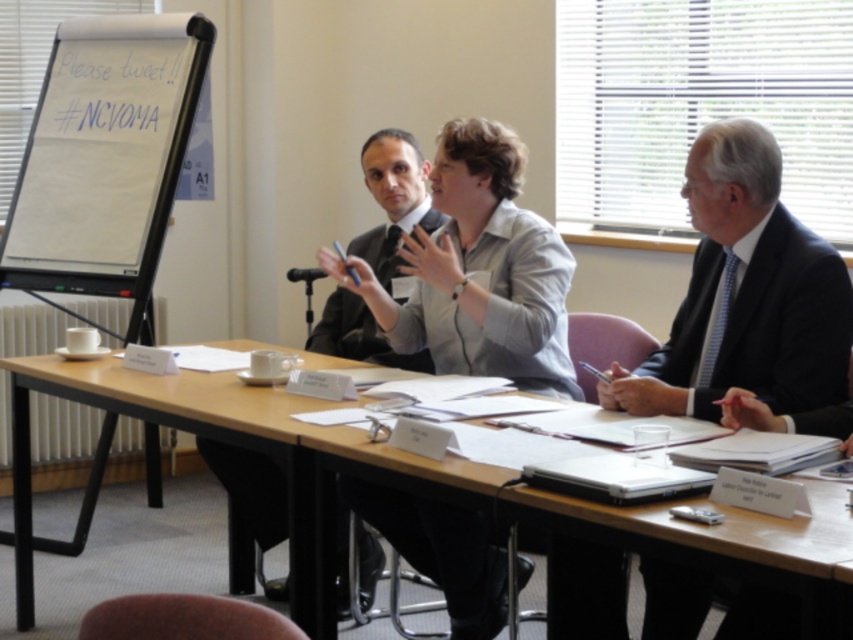
Between point (828, 502) and point (544, 337), which one is positioned in front?

Point (828, 502) is in front.

Can you confirm if light brown wood table at center is positioned below light gray shirt at center?

Correct, light brown wood table at center is located below light gray shirt at center.

Does point (22, 561) lie in front of point (563, 273)?

No.

Image resolution: width=853 pixels, height=640 pixels. I want to click on light brown wood table at center, so click(x=432, y=497).

Who is more forward, [416,163] or [300,268]?

Point [416,163] is in front.

Which is more to the left, dark gray suit at center or black plastic microphone at center?

black plastic microphone at center is more to the left.

Does point (380, 205) come closer to viewer compared to point (291, 272)?

No, (380, 205) is behind (291, 272).

The width and height of the screenshot is (853, 640). I want to click on dark gray suit at center, so click(x=393, y=198).

Based on the photo, does light brown wood table at center appear under black plastic microphone at center?

Yes, light brown wood table at center is below black plastic microphone at center.

The image size is (853, 640). What are the coordinates of `light brown wood table at center` in the screenshot? It's located at (432, 497).

You are a GUI agent. You are given a task and a screenshot of the screen. Output one action in this format:
    pyautogui.click(x=<x>, y=<y>)
    Task: Click on the light brown wood table at center
    Image resolution: width=853 pixels, height=640 pixels.
    Given the screenshot: What is the action you would take?
    pyautogui.click(x=432, y=497)